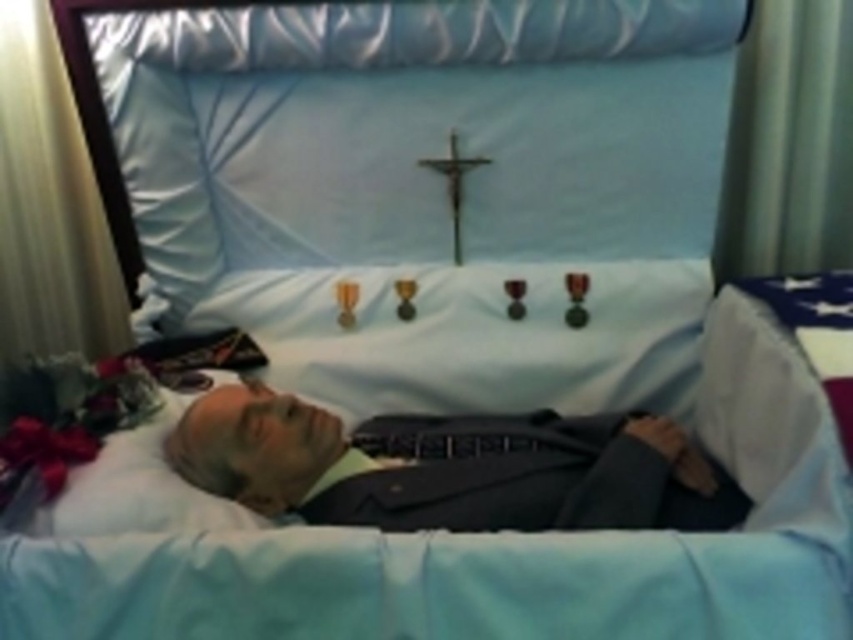
Is dark gray suit at center further to camera compared to metallic crucifix at center?

That is False.

Does dark gray suit at center appear on the right side of metallic crucifix at center?

No, dark gray suit at center is not to the right of metallic crucifix at center.

What do you see at coordinates (453, 467) in the screenshot? I see `dark gray suit at center` at bounding box center [453, 467].

The image size is (853, 640). I want to click on dark gray suit at center, so click(x=453, y=467).